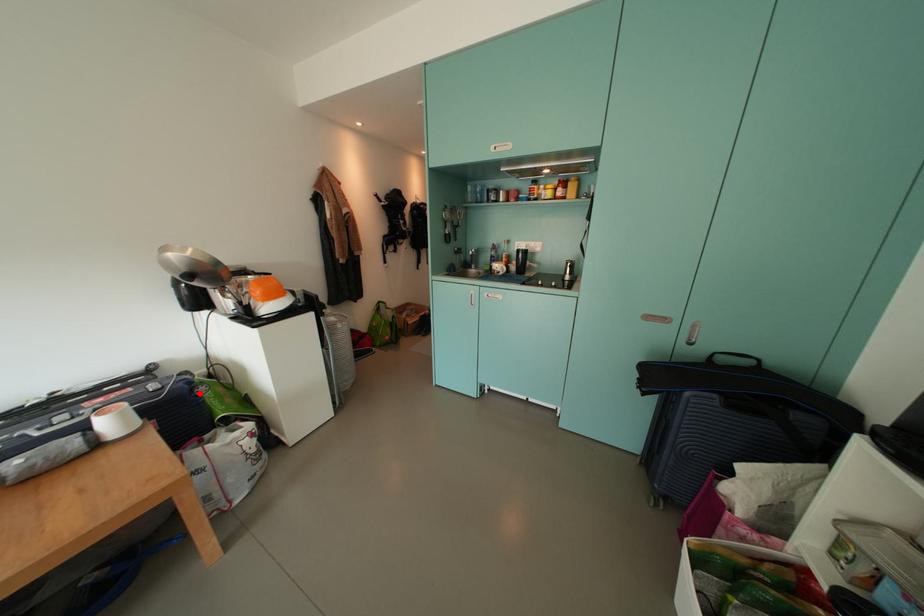
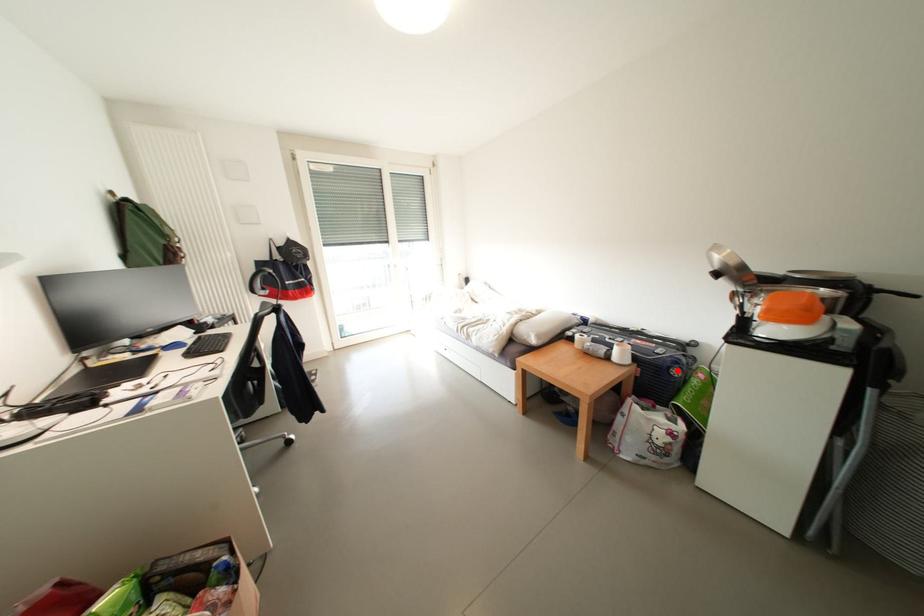
I am providing you with two images of the same scene from different viewpoints. A red point is marked on the first image and another point is marked on the second image. Is the red point in image1 aligned with the point shown in image2?

Yes